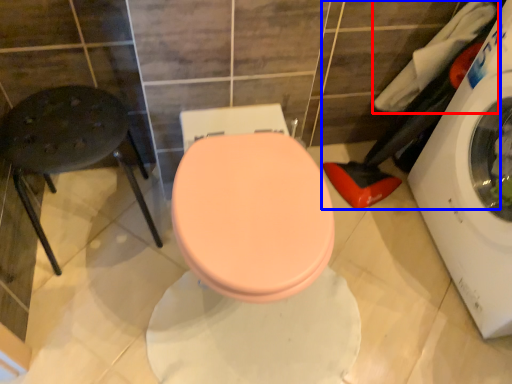
Question: Among these objects, which one is farthest to the camera, laundry (highlighted by a red box) or laundry (highlighted by a blue box)?

Choices:
 (A) laundry
 (B) laundry

Answer: (A)